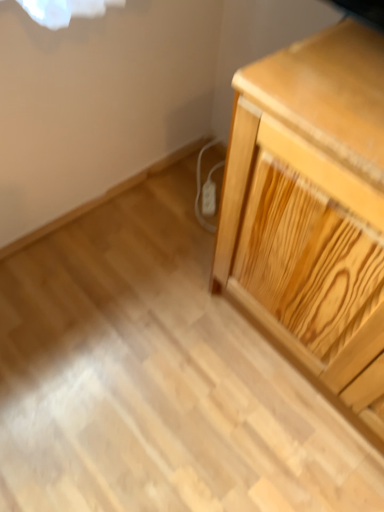
Question: From a real-world perspective, is white plastic electric outlet at lower center below light wood chest of drawers at right?

Choices:
 (A) yes
 (B) no

Answer: (A)

Question: Is white plastic electric outlet at lower center bigger than light wood chest of drawers at right?

Choices:
 (A) yes
 (B) no

Answer: (B)

Question: Does white plastic electric outlet at lower center appear on the left side of light wood chest of drawers at right?

Choices:
 (A) yes
 (B) no

Answer: (A)

Question: Is white plastic electric outlet at lower center far from light wood chest of drawers at right?

Choices:
 (A) yes
 (B) no

Answer: (B)

Question: Is white plastic electric outlet at lower center wider than light wood chest of drawers at right?

Choices:
 (A) no
 (B) yes

Answer: (A)

Question: Can you confirm if white plastic electric outlet at lower center is smaller than light wood chest of drawers at right?

Choices:
 (A) no
 (B) yes

Answer: (B)

Question: Does light wood chest of drawers at right have a larger size compared to white plastic electric outlet at lower center?

Choices:
 (A) yes
 (B) no

Answer: (A)

Question: Is white plastic electric outlet at lower center inside light wood chest of drawers at right?

Choices:
 (A) yes
 (B) no

Answer: (B)

Question: Is light wood chest of drawers at right smaller than white plastic electric outlet at lower center?

Choices:
 (A) no
 (B) yes

Answer: (A)

Question: From the image's perspective, is light wood chest of drawers at right beneath white plastic electric outlet at lower center?

Choices:
 (A) no
 (B) yes

Answer: (B)

Question: From a real-world perspective, is light wood chest of drawers at right physically below white plastic electric outlet at lower center?

Choices:
 (A) yes
 (B) no

Answer: (B)

Question: Is light wood chest of drawers at right facing towards white plastic electric outlet at lower center?

Choices:
 (A) yes
 (B) no

Answer: (B)

Question: Looking at the image, does light wood chest of drawers at right seem bigger or smaller compared to white plastic electric outlet at lower center?

Choices:
 (A) big
 (B) small

Answer: (A)